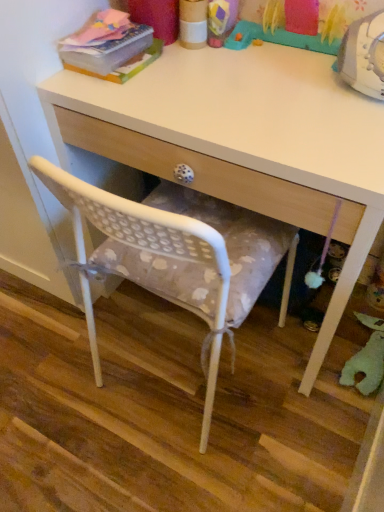
I want to click on free space underneath plastic toy at upper center, which is counted as the first toy, starting from the front (from a real-world perspective), so click(273, 52).